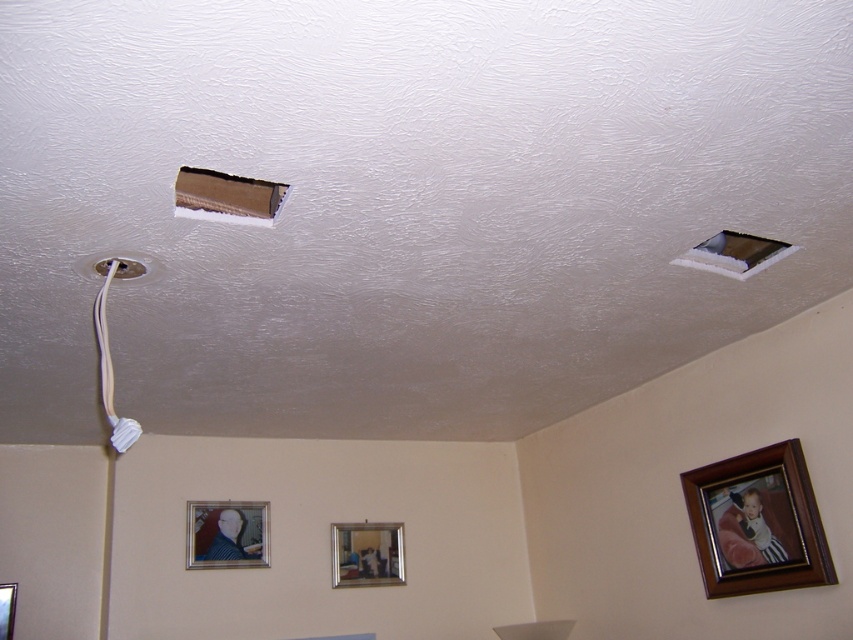
Question: Does matte silver picture frame at lower left come in front of metallic silver picture frame at lower left?

Choices:
 (A) no
 (B) yes

Answer: (A)

Question: Which of the following is the farthest from the observer?

Choices:
 (A) (206, 186)
 (B) (0, 624)

Answer: (B)

Question: Considering the relative positions of wooden picture frame at lower right and smooth white ceiling hole at upper right in the image provided, where is wooden picture frame at lower right located with respect to smooth white ceiling hole at upper right?

Choices:
 (A) right
 (B) left

Answer: (A)

Question: Which object is farther from the camera taking this photo?

Choices:
 (A) wooden picture frame at lower right
 (B) wooden picture frame at center
 (C) metallic silver picture frame at lower left
 (D) matte silver picture frame at lower left

Answer: (B)

Question: Does matte silver picture frame at lower left appear on the left side of smooth white ceiling hole at upper right?

Choices:
 (A) no
 (B) yes

Answer: (B)

Question: Which is farther from the cardboard hole at upper left?

Choices:
 (A) metallic silver picture frame at lower left
 (B) matte silver picture frame at lower left
 (C) smooth white ceiling hole at upper right

Answer: (A)